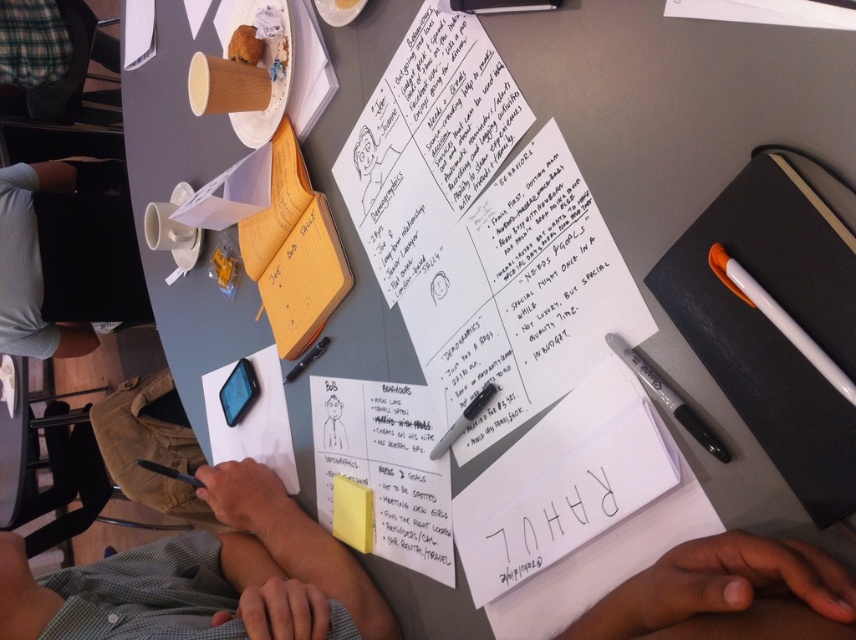
Question: Which of the following is the closest to the observer?

Choices:
 (A) green checkered shirt at lower left
 (B) black fabric shirt at left
 (C) black glossy pen at center

Answer: (A)

Question: Which point is closer to the camera?

Choices:
 (A) (21, 337)
 (B) (289, 380)
 (C) (367, 496)

Answer: (C)

Question: Is orange plastic pen at upper right to the right of black plastic pen at center from the viewer's perspective?

Choices:
 (A) no
 (B) yes

Answer: (B)

Question: Which is nearer to the green shirt at lower center?

Choices:
 (A) black plastic pen at upper right
 (B) green checkered shirt at lower left
 (C) white paper at center
 (D) black fabric shirt at left

Answer: (B)

Question: In this image, where is green checkered shirt at lower left located relative to orange plastic pen at upper right?

Choices:
 (A) below
 (B) above

Answer: (A)

Question: Is green shirt at lower center wider than black plastic pen at center?

Choices:
 (A) no
 (B) yes

Answer: (B)